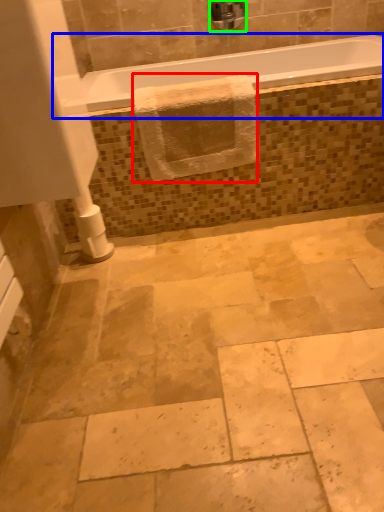
Question: Considering the real-world distances, which object is closest to bath towel (highlighted by a red box)? bathtub (highlighted by a blue box) or faucet (highlighted by a green box).

Choices:
 (A) bathtub
 (B) faucet

Answer: (A)